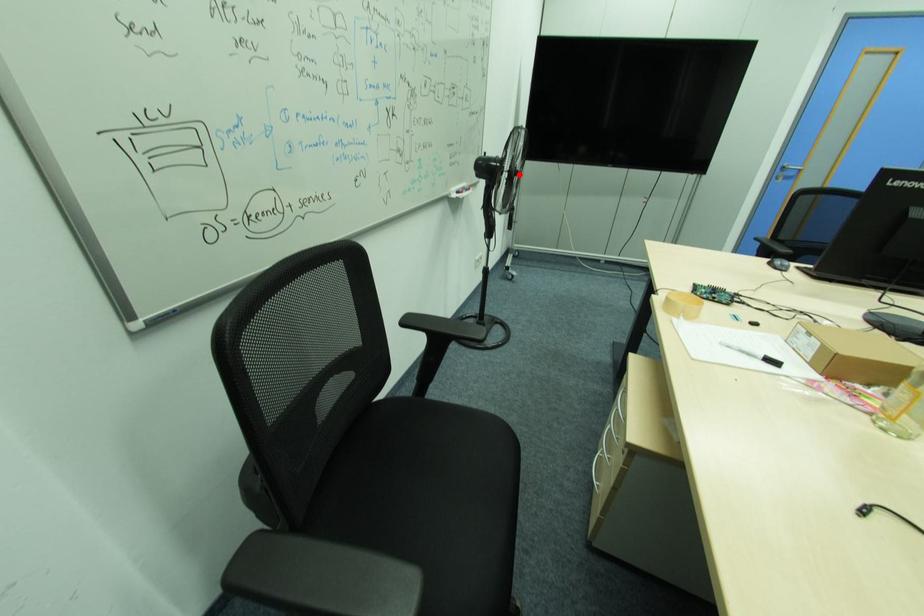
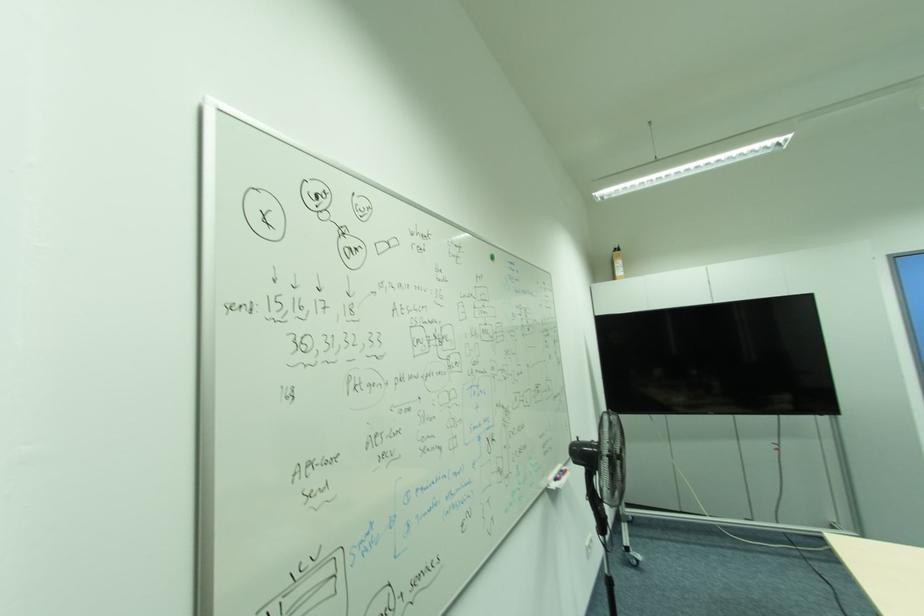
Question: I am providing you with two images of the same scene from different viewpoints. A red point is shown in image1. For the corresponding object point in image2, is it positioned nearer or farther from the camera?

Choices:
 (A) Nearer
 (B) Farther

Answer: (B)